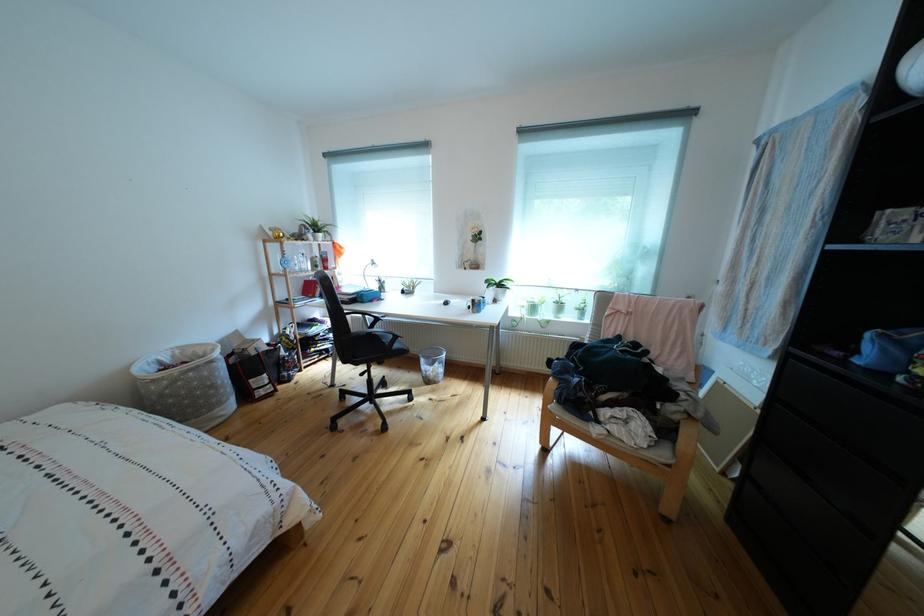
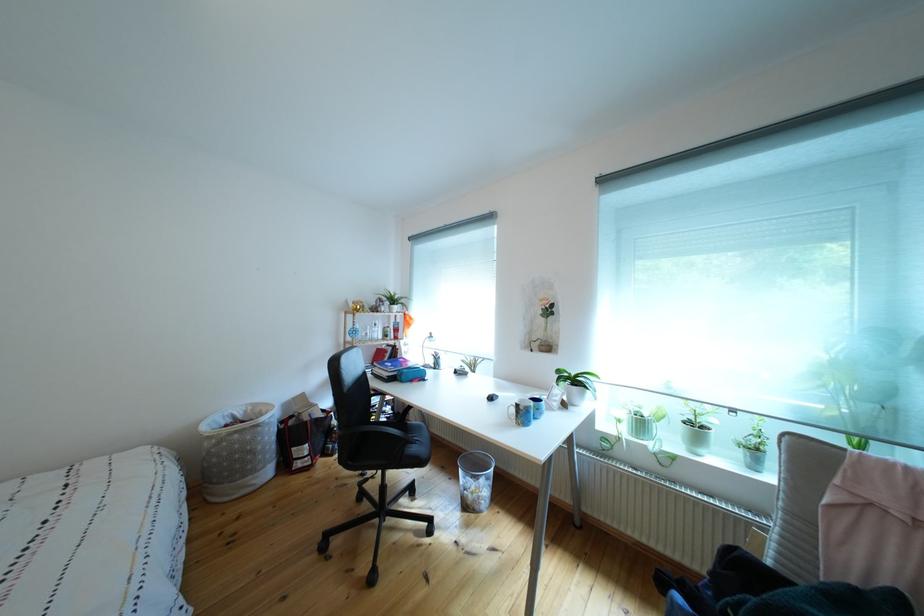
Find the pixel in the second image that matches [512,291] in the first image.

(588, 387)